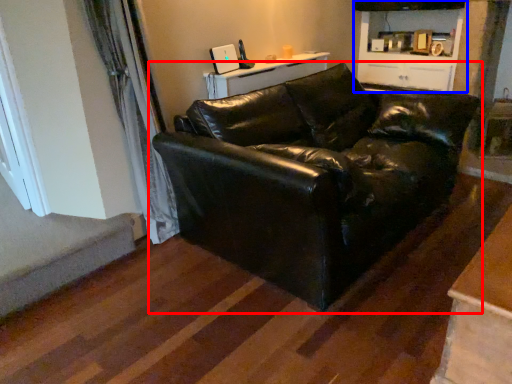
Question: Which of the following is the farthest to the observer, studio couch (highlighted by a red box) or cabinetry (highlighted by a blue box)?

Choices:
 (A) studio couch
 (B) cabinetry

Answer: (B)